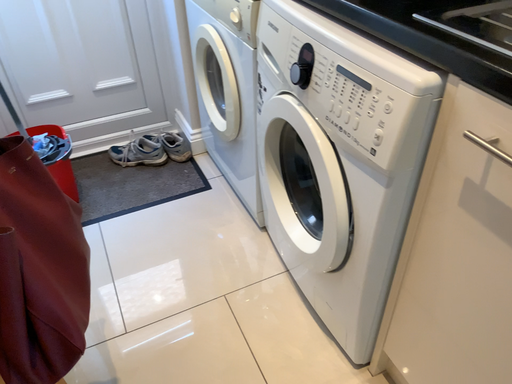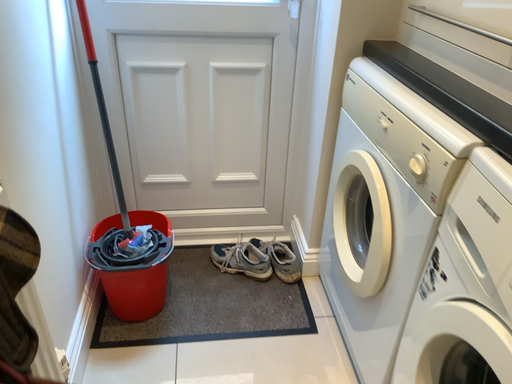
Question: Which way did the camera rotate in the video?

Choices:
 (A) rotated left
 (B) rotated right

Answer: (A)